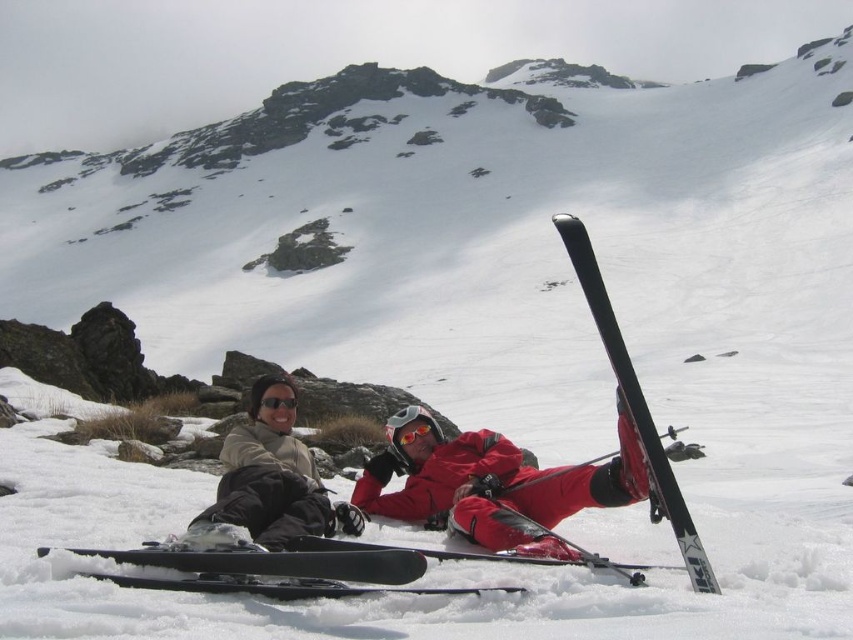
Question: Among these objects, which one is nearest to the camera?

Choices:
 (A) matte beige jacket at center
 (B) glossy orange goggles at center
 (C) black reflective goggles at center
 (D) black matte ski at lower center

Answer: (D)

Question: Does matte red snowboard at center have a larger size compared to black matte ski at center?

Choices:
 (A) no
 (B) yes

Answer: (B)

Question: Which point is farther to the camera?

Choices:
 (A) matte beige jacket at center
 (B) black reflective goggles at center
 (C) glossy orange goggles at center
 (D) black matte ski at center

Answer: (C)

Question: Can you confirm if matte red snowboard at center is thinner than black reflective goggles at center?

Choices:
 (A) no
 (B) yes

Answer: (A)

Question: Which object is the farthest from the matte red snowboard at center?

Choices:
 (A) black reflective goggles at center
 (B) matte beige jacket at center
 (C) glossy orange goggles at center

Answer: (A)

Question: Can you confirm if matte red snowboard at center is smaller than black matte ski at center?

Choices:
 (A) no
 (B) yes

Answer: (A)